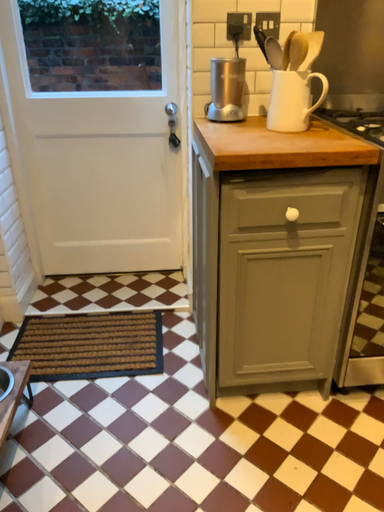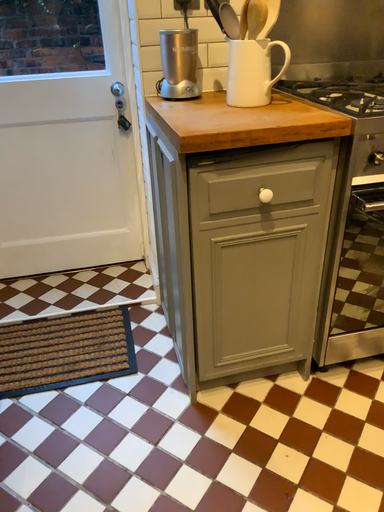
Question: How did the camera likely rotate when shooting the video?

Choices:
 (A) rotated right
 (B) rotated left

Answer: (A)